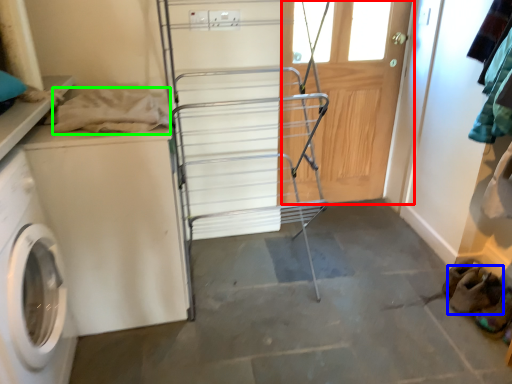
Question: Considering the real-world distances, which object is closest to screen door (highlighted by a red box)? shoe (highlighted by a blue box) or clothing (highlighted by a green box).

Choices:
 (A) shoe
 (B) clothing

Answer: (A)